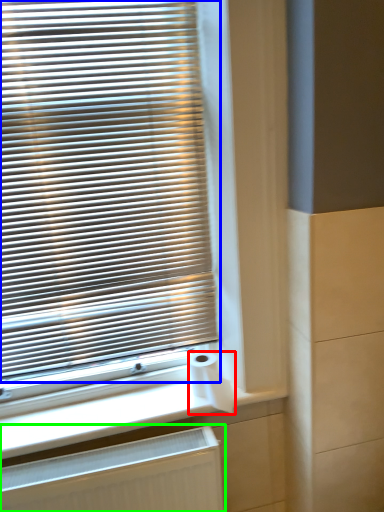
Question: Which is nearer to the toilet paper (highlighted by a red box)? window blind (highlighted by a blue box) or radiator (highlighted by a green box).

Choices:
 (A) window blind
 (B) radiator

Answer: (B)